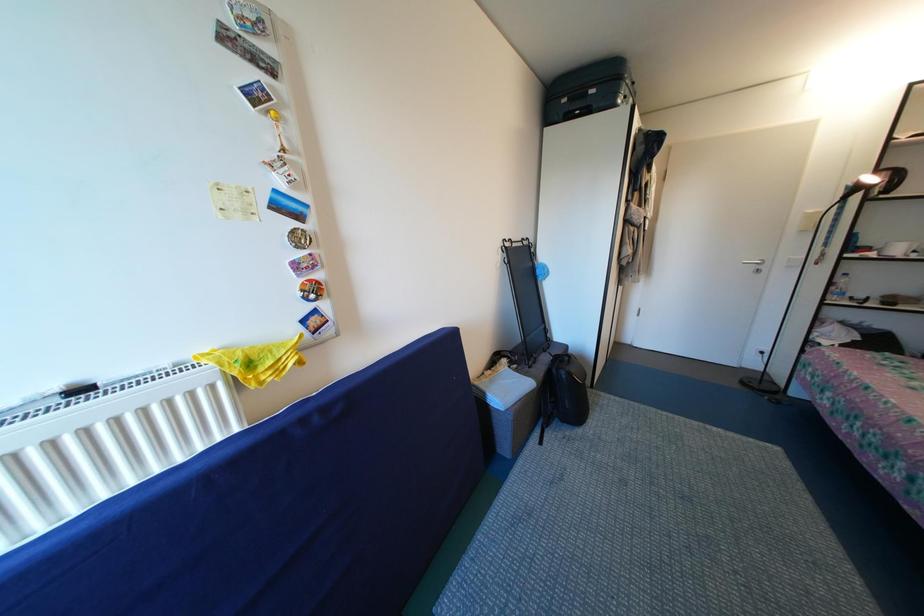
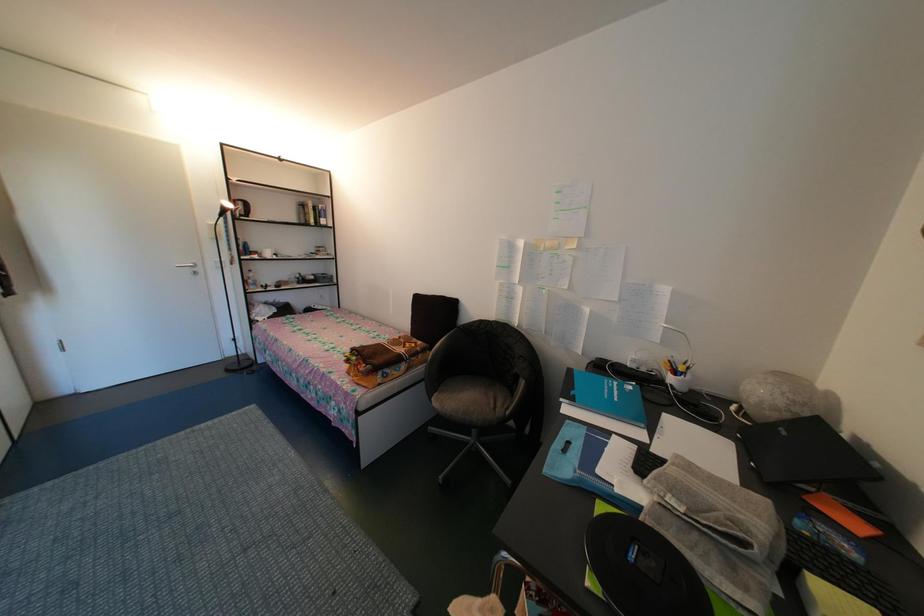
Question: The first image is from the beginning of the video and the second image is from the end. How did the camera likely rotate when shooting the video?

Choices:
 (A) Left
 (B) Right
 (C) Up
 (D) Down

Answer: (B)